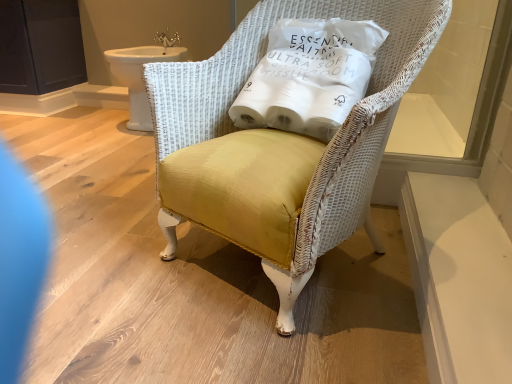
Question: From their relative heights in the image, would you say white fabric pillow at upper center is taller or shorter than white wicker chair at center?

Choices:
 (A) tall
 (B) short

Answer: (B)

Question: Is white fabric pillow at upper center wider or thinner than white wicker chair at center?

Choices:
 (A) thin
 (B) wide

Answer: (A)

Question: Estimate the real-world distances between objects in this image. Which object is closer to the transparent glass window at upper right?

Choices:
 (A) white wicker chair at center
 (B) dark matte cabinet at upper left
 (C) white fabric pillow at upper center
 (D) white ceramic sink at upper left

Answer: (C)

Question: Estimate the real-world distances between objects in this image. Which object is farther from the white ceramic sink at upper left?

Choices:
 (A) transparent glass window at upper right
 (B) dark matte cabinet at upper left
 (C) white wicker chair at center
 (D) white fabric pillow at upper center

Answer: (A)